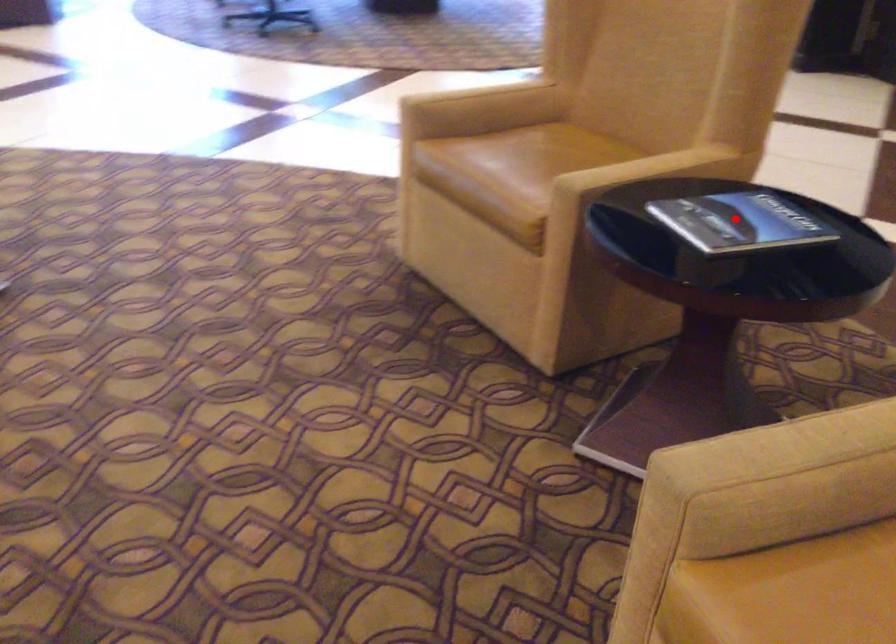
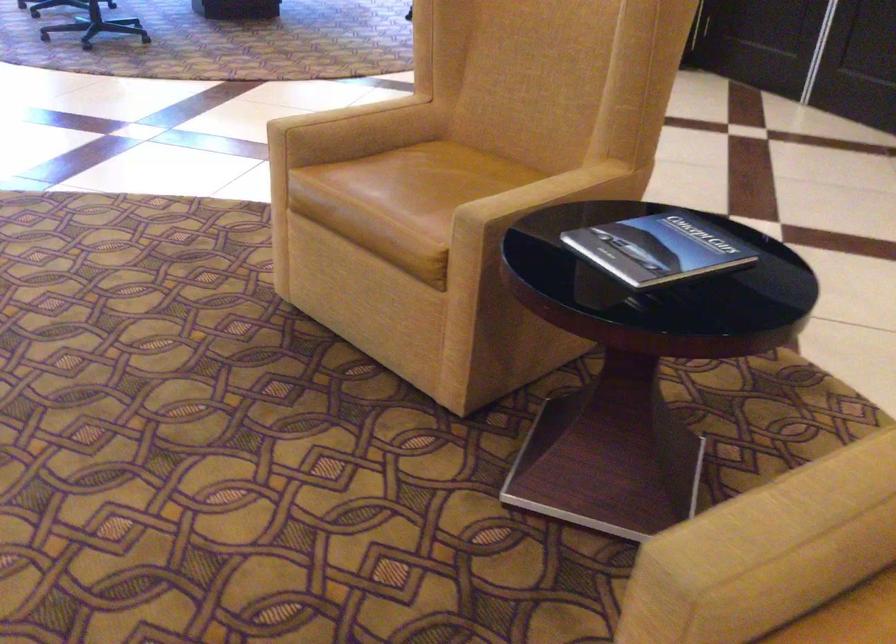
In the second image, find the point that corresponds to the highlighted location in the first image.

(657, 249)